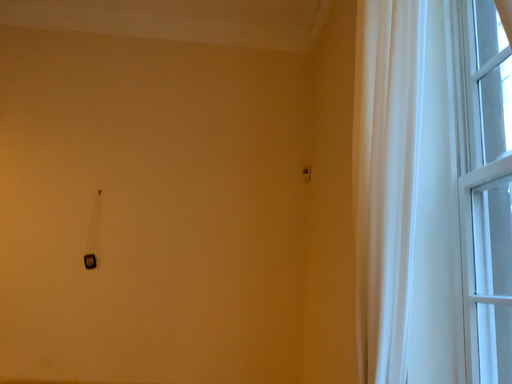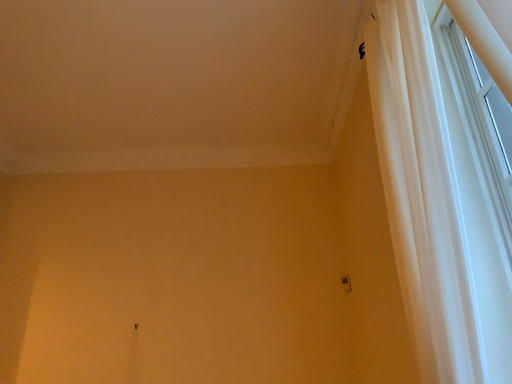
Question: How did the camera likely rotate when shooting the video?

Choices:
 (A) rotated upward
 (B) rotated downward

Answer: (A)